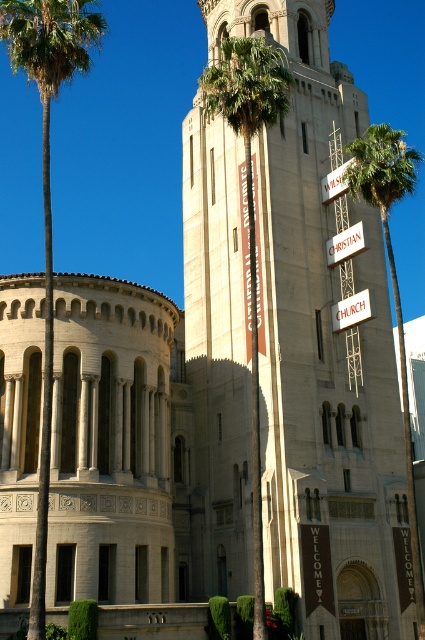
What do you see at coordinates (48, 188) in the screenshot?
I see `green leafy palm tree at left` at bounding box center [48, 188].

Is green leafy palm tree at left shorter than green leafy palm tree at center?

No, green leafy palm tree at left is not shorter than green leafy palm tree at center.

Does point (61, 13) come farther from viewer compared to point (240, 102)?

No, it is in front of (240, 102).

Locate an element on the screen. This screenshot has width=425, height=640. green leafy palm tree at left is located at coordinates (48, 188).